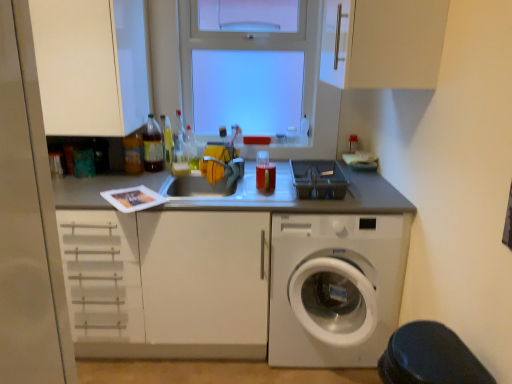
Where is `free spot above black rubber step stool at lower right (from a real-world perspective)`? The width and height of the screenshot is (512, 384). free spot above black rubber step stool at lower right (from a real-world perspective) is located at coordinates (429, 342).